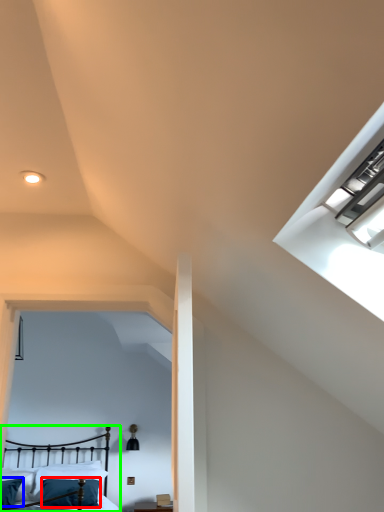
Question: Considering the real-world distances, which object is closest to pillow (highlighted by a red box)? pillow (highlighted by a blue box) or bed (highlighted by a green box).

Choices:
 (A) pillow
 (B) bed

Answer: (B)